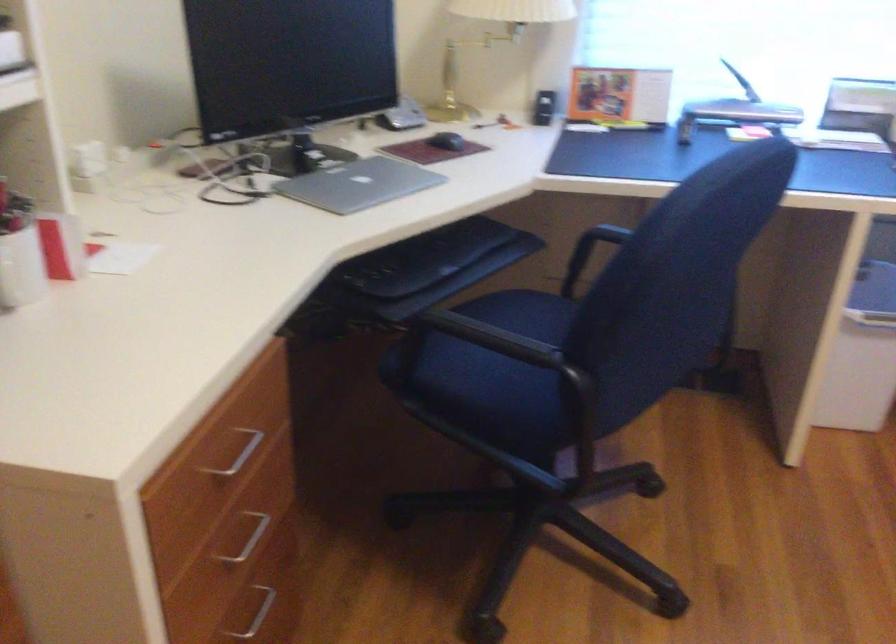
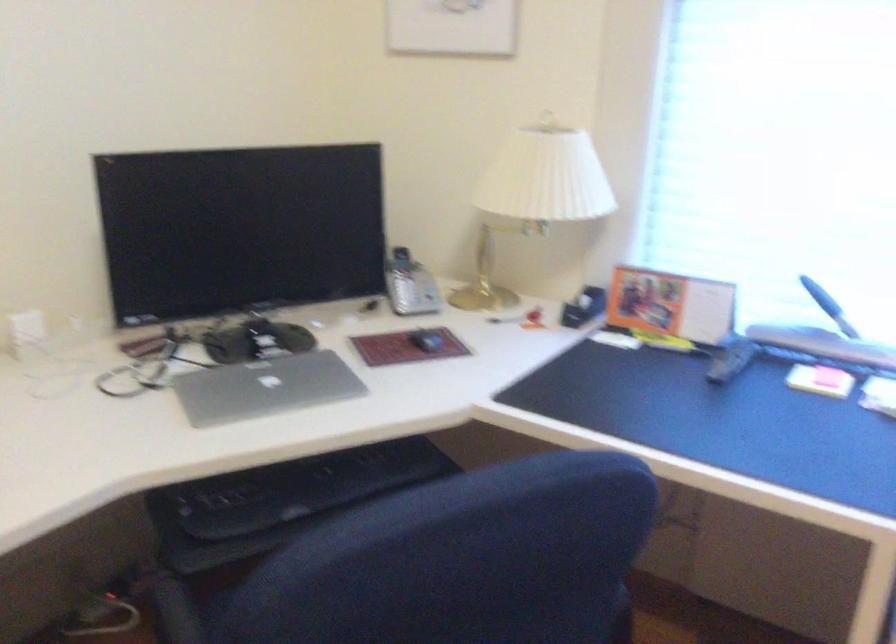
Question: The camera is either moving clockwise (left) or counter-clockwise (right) around the object. The first image is from the beginning of the video and the second image is from the end. Is the camera moving left or right when shooting the video?

Choices:
 (A) Left
 (B) Right

Answer: (B)